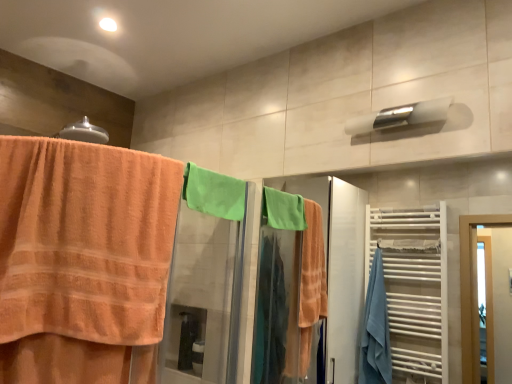
Question: Considering the relative sizes of white glossy towel bar at upper center, acting as the second towel bar starting from the right, and orange terry cloth towel at left in the image provided, is white glossy towel bar at upper center, acting as the second towel bar starting from the right, wider than orange terry cloth towel at left?

Choices:
 (A) yes
 (B) no

Answer: (B)

Question: Is white glossy towel bar at upper center, the first towel bar in the left-to-right sequence, next to orange terry cloth towel at left?

Choices:
 (A) no
 (B) yes

Answer: (A)

Question: Does white glossy towel bar at upper center, the first towel bar in the left-to-right sequence, contain orange terry cloth towel at left?

Choices:
 (A) yes
 (B) no

Answer: (B)

Question: From the image's perspective, would you say white glossy towel bar at upper center, acting as the second towel bar starting from the right, is shown under orange terry cloth towel at left?

Choices:
 (A) yes
 (B) no

Answer: (B)

Question: Is white glossy towel bar at upper center, acting as the second towel bar starting from the right, not inside orange terry cloth towel at left?

Choices:
 (A) no
 (B) yes

Answer: (B)

Question: Is point (x=92, y=150) positioned closer to the camera than point (x=309, y=289)?

Choices:
 (A) farther
 (B) closer

Answer: (B)

Question: From the image's perspective, is orange terry cloth towel at left above or below green towel at upper right?

Choices:
 (A) above
 (B) below

Answer: (A)

Question: In the image, is orange terry cloth towel at left on the left side or the right side of green towel at upper right?

Choices:
 (A) left
 (B) right

Answer: (A)

Question: In terms of width, does orange terry cloth towel at left look wider or thinner when compared to green towel at upper right?

Choices:
 (A) wide
 (B) thin

Answer: (A)

Question: In the image, is orange terry cloth towel at left on the left side or the right side of white glossy towel bar at upper center, acting as the second towel bar starting from the right?

Choices:
 (A) right
 (B) left

Answer: (A)

Question: From a real-world perspective, relative to white glossy towel bar at upper center, the first towel bar in the left-to-right sequence, is orange terry cloth towel at left vertically above or below?

Choices:
 (A) below
 (B) above

Answer: (A)

Question: In terms of height, does orange terry cloth towel at left look taller or shorter compared to white glossy towel bar at upper center, the first towel bar in the left-to-right sequence?

Choices:
 (A) short
 (B) tall

Answer: (B)

Question: Does point pyautogui.click(x=154, y=251) appear closer or farther from the camera than point pyautogui.click(x=78, y=132)?

Choices:
 (A) closer
 (B) farther

Answer: (A)

Question: Looking at their shapes, would you say satin silver towel bar at upper center, placed as the first towel bar when sorted from right to left, is wider or thinner than orange terry cloth towel at left?

Choices:
 (A) thin
 (B) wide

Answer: (A)

Question: Considering the positions of satin silver towel bar at upper center, which ranks as the 2th towel bar in left-to-right order, and orange terry cloth towel at left in the image, is satin silver towel bar at upper center, which ranks as the 2th towel bar in left-to-right order, taller or shorter than orange terry cloth towel at left?

Choices:
 (A) short
 (B) tall

Answer: (A)